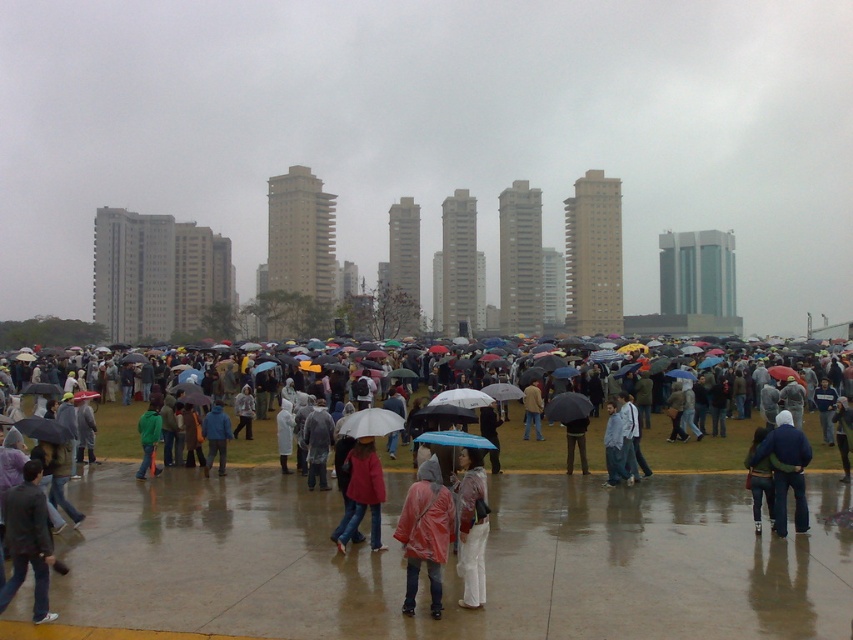
You are standing at the camera position and want to reach the point at coordinates (810, 451) in the image. Given that the distance between you and that point is 44.06 feet, can you estimate whether you can walk straight to it without needing to detour around obstacles?

The point at coordinates (810, 451) is 44.06 feet away from the camera position. Since the scene describes a large outdoor gathering with many people and umbrellas, there might be obstacles in the way. However, the question only asks about walking straight to the point without needing to detour around obstacles, so the distance itself doesn not indicate the presence of obstacles. Therefore, the answer is yes, you can walk straight to it without needing to detour around obstacles if there are no people or

You are a photographer trying to capture a clear shot of both the raincoatwaterproofperson at center and the red matte jacket at center. Given their sizes, which one would you need to get closer to in order to ensure both are equally detailed in your photo?

The raincoatwaterproofperson at center is smaller in size compared to the red matte jacket at center. To ensure both are equally detailed, you would need to get closer to the raincoatwaterproofperson at center so that its smaller size is adequately captured in the photo.